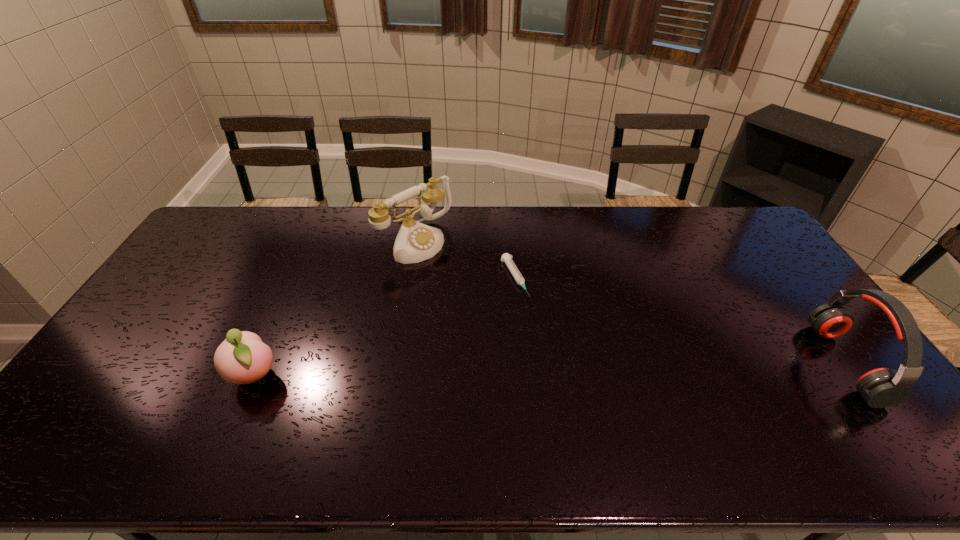
Where is `object situated at the near right corner`? object situated at the near right corner is located at coordinates (883, 387).

The width and height of the screenshot is (960, 540). Find the location of `free space at the far edge`. free space at the far edge is located at coordinates point(304,227).

This screenshot has height=540, width=960. I want to click on vacant position at the near edge of the desktop, so click(652, 411).

This screenshot has width=960, height=540. In the image, there is a desktop. What are the coordinates of `vacant space at the right edge` in the screenshot? It's located at (813, 382).

The image size is (960, 540). Identify the location of vacant space at the far left corner of the desktop. 252,221.

Find the location of `free space at the near left corner`. free space at the near left corner is located at coordinates (138, 399).

In order to click on free space at the far right corner of the desktop in this screenshot , I will do `click(720, 235)`.

I want to click on vacant space that is in between the second object from left to right and the shortest object, so click(466, 260).

Where is `empty space between the earphone and the shortest object`? empty space between the earphone and the shortest object is located at coordinates (680, 321).

Where is `vacant space that's between the leftmost object and the rightmost object`? vacant space that's between the leftmost object and the rightmost object is located at coordinates tap(550, 369).